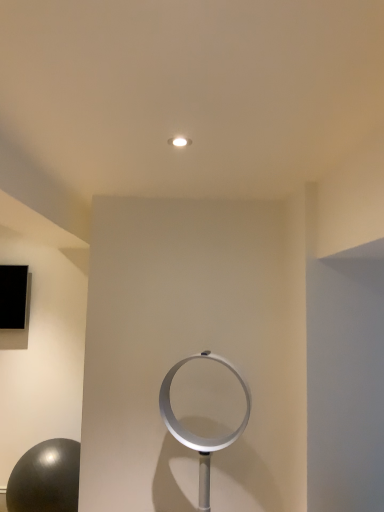
Where is `silver metallic fan at center`? The width and height of the screenshot is (384, 512). silver metallic fan at center is located at coordinates (179, 422).

This screenshot has height=512, width=384. What do you see at coordinates (179, 422) in the screenshot?
I see `silver metallic fan at center` at bounding box center [179, 422].

This screenshot has height=512, width=384. In order to click on shiny black ball at lower left in this screenshot , I will do `click(46, 478)`.

The width and height of the screenshot is (384, 512). What do you see at coordinates (46, 478) in the screenshot? I see `shiny black ball at lower left` at bounding box center [46, 478].

At what (x,y) coordinates should I click in order to perform the action: click on silver metallic fan at center. Please return your answer as a coordinate pair (x, y). Looking at the image, I should click on (179, 422).

Can you confirm if silver metallic fan at center is positioned to the right of shiny black ball at lower left?

Indeed, silver metallic fan at center is positioned on the right side of shiny black ball at lower left.

Is silver metallic fan at center in front of or behind shiny black ball at lower left in the image?

Clearly, silver metallic fan at center is in front of shiny black ball at lower left.

Which is in front, point (181, 441) or point (75, 477)?

Positioned in front is point (181, 441).

From the image's perspective, is silver metallic fan at center located above or below shiny black ball at lower left?

From the image's perspective, silver metallic fan at center appears above shiny black ball at lower left.

From a real-world perspective, which object stands above the other?

silver metallic fan at center, from a real-world perspective.

Considering the sizes of silver metallic fan at center and shiny black ball at lower left in the image, is silver metallic fan at center wider or thinner than shiny black ball at lower left?

In the image, silver metallic fan at center appears to be more narrow than shiny black ball at lower left.

Looking at this image, considering the relative sizes of silver metallic fan at center and shiny black ball at lower left in the image provided, is silver metallic fan at center taller than shiny black ball at lower left?

Indeed, silver metallic fan at center has a greater height compared to shiny black ball at lower left.

Is silver metallic fan at center bigger or smaller than shiny black ball at lower left?

In the image, silver metallic fan at center appears to be smaller than shiny black ball at lower left.

Could shiny black ball at lower left be considered to be inside silver metallic fan at center?

Actually, shiny black ball at lower left is outside silver metallic fan at center.

Is silver metallic fan at center next to shiny black ball at lower left and touching it?

No, silver metallic fan at center is not beside shiny black ball at lower left.

Is silver metallic fan at center aimed at shiny black ball at lower left?

No, silver metallic fan at center is not turned towards shiny black ball at lower left.

The height and width of the screenshot is (512, 384). What are the coordinates of `ball located on the left of silver metallic fan at center` in the screenshot? It's located at (46, 478).

Considering the positions of objects shiny black ball at lower left and silver metallic fan at center in the image provided, who is more to the left, shiny black ball at lower left or silver metallic fan at center?

Positioned to the left is shiny black ball at lower left.

Looking at this image, which object is further away from the camera taking this photo, shiny black ball at lower left or silver metallic fan at center?

shiny black ball at lower left is further from the camera.

Is point (54, 456) positioned behind point (164, 408)?

That is True.

From the image's perspective, between shiny black ball at lower left and silver metallic fan at center, who is located below?

shiny black ball at lower left.

From a real-world perspective, is shiny black ball at lower left physically above silver metallic fan at center?

Incorrect, from a real-world perspective, shiny black ball at lower left is lower than silver metallic fan at center.

Considering the sizes of shiny black ball at lower left and silver metallic fan at center in the image, is shiny black ball at lower left wider or thinner than silver metallic fan at center?

Considering their sizes, shiny black ball at lower left looks broader than silver metallic fan at center.

Based on the photo, can you confirm if shiny black ball at lower left is taller than silver metallic fan at center?

In fact, shiny black ball at lower left may be shorter than silver metallic fan at center.

Between shiny black ball at lower left and silver metallic fan at center, which one has smaller size?

silver metallic fan at center is smaller.

Is shiny black ball at lower left inside the boundaries of silver metallic fan at center, or outside?

shiny black ball at lower left lies outside silver metallic fan at center.

Is shiny black ball at lower left beside silver metallic fan at center?

No.

Looking at this image, is shiny black ball at lower left aimed at silver metallic fan at center?

No, shiny black ball at lower left is not turned towards silver metallic fan at center.

How different are the orientations of shiny black ball at lower left and silver metallic fan at center in degrees?

There is a 19.9-degree angle between the facing directions of shiny black ball at lower left and silver metallic fan at center.

Where is `ball that is behind the silver metallic fan at center`? ball that is behind the silver metallic fan at center is located at coordinates (46, 478).

I want to click on circle lying on the right of shiny black ball at lower left, so click(179, 422).

The height and width of the screenshot is (512, 384). I want to click on circle above the shiny black ball at lower left (from the image's perspective), so click(179, 422).